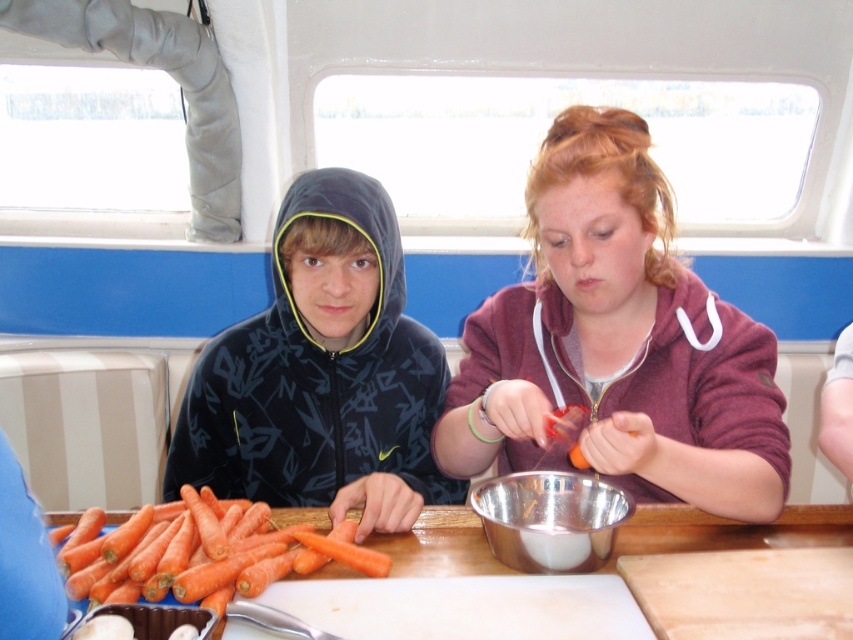
Does point (463, 515) lie behind point (589, 506)?

Yes, point (463, 515) is farther from viewer.

The image size is (853, 640). What are the coordinates of `orange wood table at center` in the screenshot? It's located at (728, 531).

Does point (679, 524) come farther from viewer compared to point (601, 500)?

Yes, it is.

The image size is (853, 640). I want to click on orange wood table at center, so click(728, 531).

Consider the image. Can you confirm if orange wood table at center is smaller than orange matte carrots at lower left?

Incorrect, orange wood table at center is not smaller in size than orange matte carrots at lower left.

Can you confirm if orange wood table at center is positioned to the left of orange matte carrots at lower left?

In fact, orange wood table at center is to the right of orange matte carrots at lower left.

Where is `orange wood table at center`? orange wood table at center is located at coordinates (728, 531).

Locate an element on the screen. orange wood table at center is located at coordinates (728, 531).

Which is behind, point (393, 234) or point (706, 548)?

Point (393, 234)

Locate an element on the screen. matte black hoodie at center is located at coordinates (321, 372).